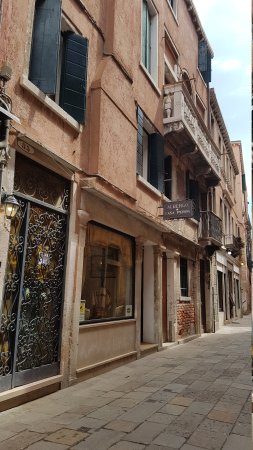
Identify the location of window. This screenshot has height=450, width=253. [144, 56].